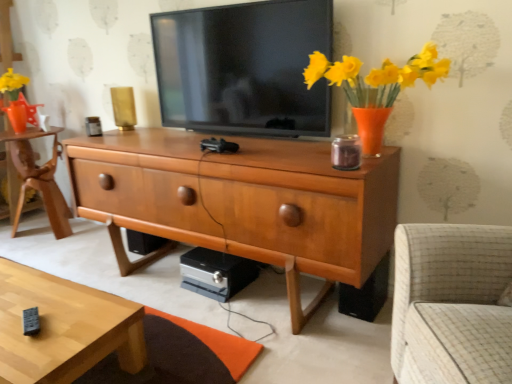
Question: Is wooden chest of drawers at center at the right side of black plastic speaker at lower right?

Choices:
 (A) no
 (B) yes

Answer: (A)

Question: Is wooden chest of drawers at center positioned in front of black plastic speaker at lower right?

Choices:
 (A) yes
 (B) no

Answer: (A)

Question: Would you say wooden chest of drawers at center contains black plastic speaker at lower right?

Choices:
 (A) no
 (B) yes

Answer: (B)

Question: Does wooden chest of drawers at center have a lesser height compared to black plastic speaker at lower right?

Choices:
 (A) no
 (B) yes

Answer: (A)

Question: Is wooden chest of drawers at center smaller than black plastic speaker at lower right?

Choices:
 (A) no
 (B) yes

Answer: (A)

Question: From a real-world perspective, relative to light brown wooden desk at left, is black plastic speaker at lower right vertically above or below?

Choices:
 (A) below
 (B) above

Answer: (A)

Question: Looking at the image, does black plastic speaker at lower right seem bigger or smaller compared to light brown wooden desk at left?

Choices:
 (A) big
 (B) small

Answer: (B)

Question: Is black plastic speaker at lower right to the left or to the right of light brown wooden desk at left in the image?

Choices:
 (A) left
 (B) right

Answer: (B)

Question: From the image's perspective, is black plastic speaker at lower right positioned above or below light brown wooden desk at left?

Choices:
 (A) below
 (B) above

Answer: (A)

Question: Based on their sizes in the image, would you say matte black tv at center is bigger or smaller than light wood/texture coffee table at lower left?

Choices:
 (A) big
 (B) small

Answer: (B)

Question: From a real-world perspective, is matte black tv at center positioned above or below light wood/texture coffee table at lower left?

Choices:
 (A) below
 (B) above

Answer: (B)

Question: From their relative heights in the image, would you say matte black tv at center is taller or shorter than light wood/texture coffee table at lower left?

Choices:
 (A) tall
 (B) short

Answer: (A)

Question: From the image's perspective, is matte black tv at center above or below light wood/texture coffee table at lower left?

Choices:
 (A) above
 (B) below

Answer: (A)

Question: Is point (6, 139) positioned closer to the camera than point (214, 54)?

Choices:
 (A) farther
 (B) closer

Answer: (A)

Question: Relative to matte black tv at center, is light brown wooden desk at left in front or behind?

Choices:
 (A) behind
 (B) front

Answer: (A)